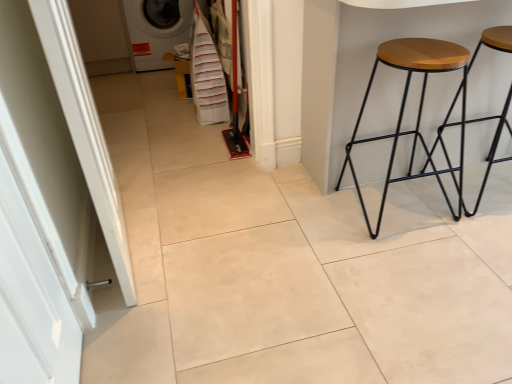
This screenshot has height=384, width=512. Identify the location of free space between wooden/black metal stool at right, which is counted as the 1th stool, starting from the left, and wooden seat stool at right, which appears as the second stool when viewed from the left. (445, 196).